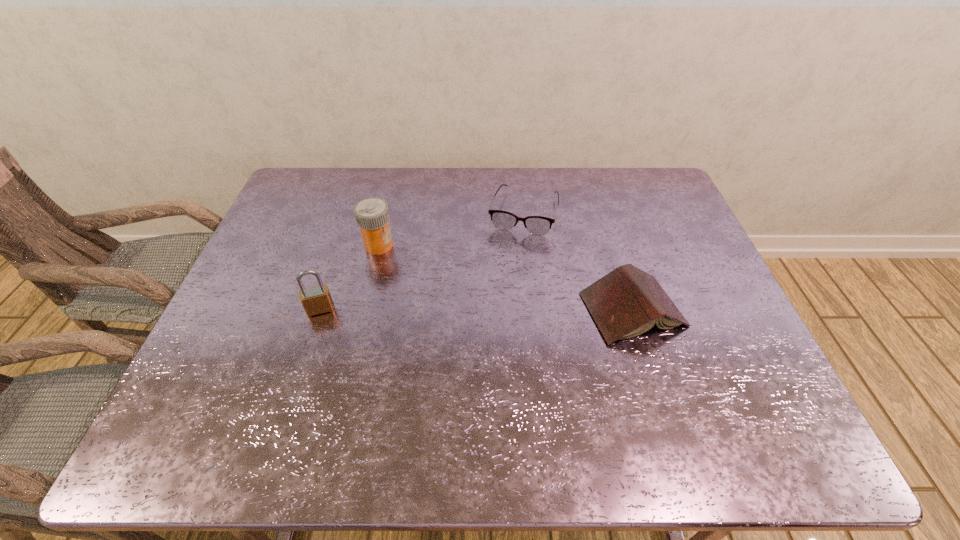
At what (x,y) coordinates should I click in order to perform the action: click on vacant space on the desktop that is between the leftmost object and the book and is positioned on the label side of the medicine. Please return your answer as a coordinate pair (x, y). The height and width of the screenshot is (540, 960). Looking at the image, I should click on (468, 309).

Locate an element on the screen. Image resolution: width=960 pixels, height=540 pixels. free space on the desktop that is between the leftmost object and the rightmost object and is positioned on the face of the spectacles is located at coordinates (496, 309).